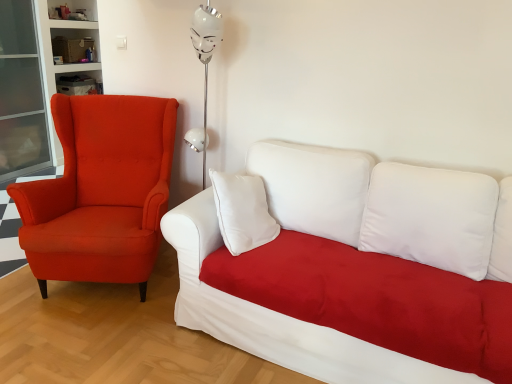
Describe the element at coordinates (352, 267) in the screenshot. The height and width of the screenshot is (384, 512). I see `white fabric couch at center` at that location.

In order to face white fabric couch at center, should I rotate leftwards or rightwards?

You should look right and rotate roughly 12.217 degrees.

You are a GUI agent. You are given a task and a screenshot of the screen. Output one action in this format:
    pyautogui.click(x=<x>, y=<y>)
    Task: Click on the white fabric couch at center
    The width and height of the screenshot is (512, 384).
    Given the screenshot: What is the action you would take?
    pyautogui.click(x=352, y=267)

What is the approximate width of matte orange armchair at left?

It is 36.54 inches.

What do you see at coordinates (101, 191) in the screenshot?
I see `matte orange armchair at left` at bounding box center [101, 191].

Image resolution: width=512 pixels, height=384 pixels. In order to click on matte orange armchair at left in this screenshot , I will do `click(101, 191)`.

You are a GUI agent. You are given a task and a screenshot of the screen. Output one action in this format:
    pyautogui.click(x=<x>, y=<y>)
    Task: Click on the white fabric couch at center
    This screenshot has height=384, width=512.
    Given the screenshot: What is the action you would take?
    pyautogui.click(x=352, y=267)

Considering the positions of objects white fabric couch at center and matte orange armchair at left in the image provided, who is more to the right, white fabric couch at center or matte orange armchair at left?

Positioned to the right is white fabric couch at center.

Between white fabric couch at center and matte orange armchair at left, which one is positioned behind?

matte orange armchair at left.

Considering the points (351, 157) and (28, 191), which point is in front, point (351, 157) or point (28, 191)?

Positioned in front is point (28, 191).

From the image's perspective, between white fabric couch at center and matte orange armchair at left, which one is located above?

From the image's view, matte orange armchair at left is above.

From a real-world perspective, relative to matte orange armchair at left, is white fabric couch at center vertically above or below?

From a real-world perspective, white fabric couch at center is physically below matte orange armchair at left.

Considering the sizes of white fabric couch at center and matte orange armchair at left in the image, is white fabric couch at center wider or thinner than matte orange armchair at left?

Clearly, white fabric couch at center has more width compared to matte orange armchair at left.

Does white fabric couch at center have a greater height compared to matte orange armchair at left?

No.

Looking at the image, does white fabric couch at center seem bigger or smaller compared to matte orange armchair at left?

white fabric couch at center is bigger than matte orange armchair at left.

Is white fabric couch at center inside the boundaries of matte orange armchair at left, or outside?

white fabric couch at center is not inside matte orange armchair at left, it's outside.

Is there a large distance between white fabric couch at center and matte orange armchair at left?

No, white fabric couch at center is not far away from matte orange armchair at left.

Is white fabric couch at center positioned with its back to matte orange armchair at left?

No, white fabric couch at center is not facing the opposite direction of matte orange armchair at left.

In the scene shown: Can you tell me how much white fabric couch at center and matte orange armchair at left differ in facing direction?

They differ by 27.6 degrees in their facing directions.

Measure the distance from white fabric couch at center to matte orange armchair at left.

white fabric couch at center and matte orange armchair at left are 33.35 inches apart.

In order to click on chair above the white fabric couch at center (from a real-world perspective) in this screenshot , I will do `click(101, 191)`.

Which is more to the left, matte orange armchair at left or white fabric couch at center?

Positioned to the left is matte orange armchair at left.

Which object is more forward, matte orange armchair at left or white fabric couch at center?

Positioned in front is white fabric couch at center.

Considering the points (137, 188) and (511, 272), which point is in front, point (137, 188) or point (511, 272)?

The point (511, 272) is in front.

From the image's perspective, would you say matte orange armchair at left is positioned over white fabric couch at center?

Yes, from the image's perspective, matte orange armchair at left is above white fabric couch at center.

From a real-world perspective, which is physically above, matte orange armchair at left or white fabric couch at center?

In real-world perspective, matte orange armchair at left is above.

Considering the sizes of matte orange armchair at left and white fabric couch at center in the image, is matte orange armchair at left wider or thinner than white fabric couch at center?

matte orange armchair at left is thinner than white fabric couch at center.

From their relative heights in the image, would you say matte orange armchair at left is taller or shorter than white fabric couch at center?

Clearly, matte orange armchair at left is taller compared to white fabric couch at center.

Who is bigger, matte orange armchair at left or white fabric couch at center?

Bigger between the two is white fabric couch at center.

Is matte orange armchair at left not inside white fabric couch at center?

Yes.

Is matte orange armchair at left next to white fabric couch at center?

No, matte orange armchair at left is not beside white fabric couch at center.

In the scene shown: Is matte orange armchair at left oriented away from white fabric couch at center?

No, matte orange armchair at left is not facing the opposite direction of white fabric couch at center.

Where is `studio couch that appears on the right of matte orange armchair at left`? studio couch that appears on the right of matte orange armchair at left is located at coordinates (352, 267).

There is a white fabric couch at center. Identify the location of chair above it (from a real-world perspective). (101, 191).

Locate an element on the screen. This screenshot has height=384, width=512. chair on the left of the white fabric couch at center is located at coordinates (101, 191).